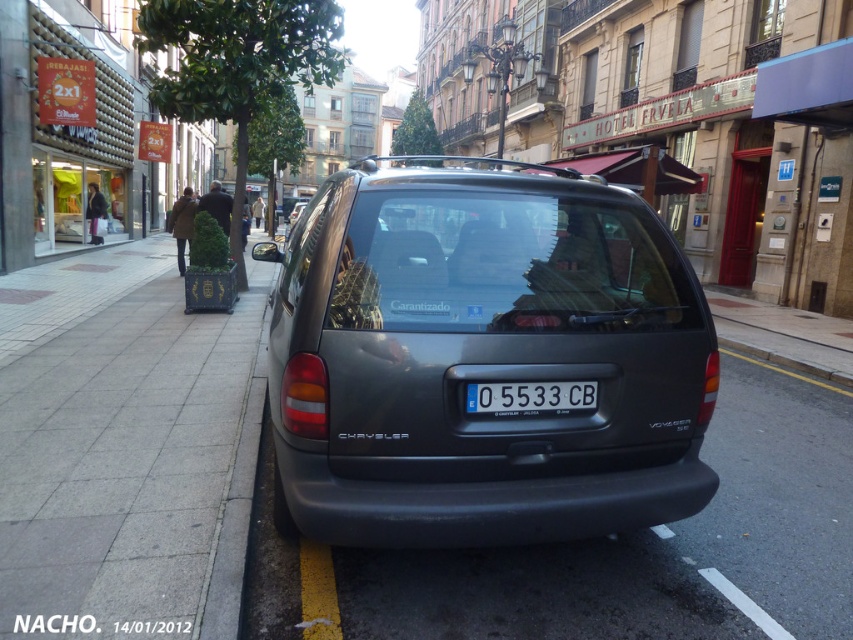
Question: Which of the following is the farthest from the observer?

Choices:
 (A) white plastic license plate at center
 (B) gray concrete curb at lower left

Answer: (A)

Question: Which of the following is the closest to the observer?

Choices:
 (A) (556, 401)
 (B) (213, 627)

Answer: (B)

Question: Does gray concrete curb at lower left have a smaller size compared to white plastic license plate at center?

Choices:
 (A) no
 (B) yes

Answer: (A)

Question: Which object appears closest to the camera in this image?

Choices:
 (A) white plastic license plate at center
 (B) gray concrete curb at lower left
 (C) gray concrete pavement at lower left

Answer: (C)

Question: Is gray concrete pavement at lower left above gray concrete curb at lower left?

Choices:
 (A) no
 (B) yes

Answer: (A)

Question: Does white plastic license plate at center have a larger size compared to satin black van at center?

Choices:
 (A) yes
 (B) no

Answer: (B)